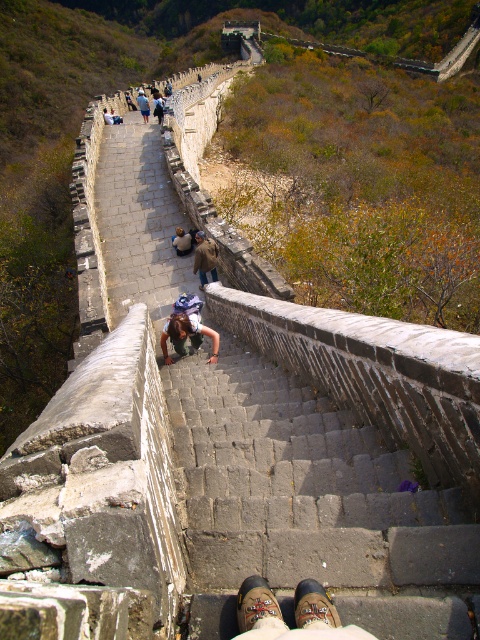
Who is lower down, gray stone stairs at center or denim jacket at upper center?

gray stone stairs at center is below.

Consider the image. Who is more forward, (423, 627) or (163, 116)?

Point (423, 627) is in front.

Which is in front, point (284, 403) or point (159, 100)?

Point (284, 403)

Locate an element on the screen. gray stone stairs at center is located at coordinates (309, 504).

Is brown leather shoes at lower center positioned in front of blue denim jeans at center?

Yes, it is in front of blue denim jeans at center.

Is brown leather shoes at lower center bigger than blue denim jeans at center?

Actually, brown leather shoes at lower center might be smaller than blue denim jeans at center.

Find the location of a particular element. This screenshot has width=480, height=640. brown leather shoes at lower center is located at coordinates (295, 612).

Locate an element on the screen. The image size is (480, 640). brown leather shoes at lower center is located at coordinates (295, 612).

Who is higher up, brown leather backpack at center or light blue denim jeans at center?

light blue denim jeans at center is above.

Is brown leather backpack at center closer to the viewer compared to light blue denim jeans at center?

Yes.

Describe the element at coordinates (204, 257) in the screenshot. The image size is (480, 640). I see `brown leather backpack at center` at that location.

At what (x,y) coordinates should I click in order to perform the action: click on brown leather backpack at center. Please return your answer as a coordinate pair (x, y). This screenshot has width=480, height=640. Looking at the image, I should click on (204, 257).